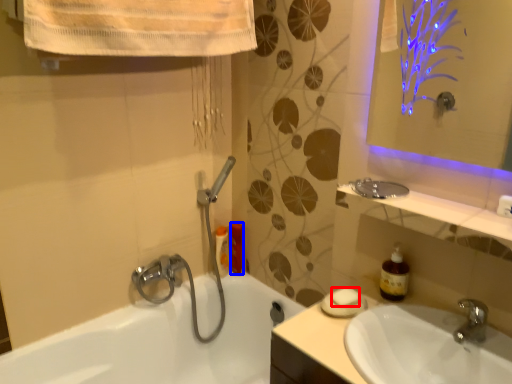
Question: Among these objects, which one is farthest to the camera, soap (highlighted by a red box) or toiletry (highlighted by a blue box)?

Choices:
 (A) soap
 (B) toiletry

Answer: (B)